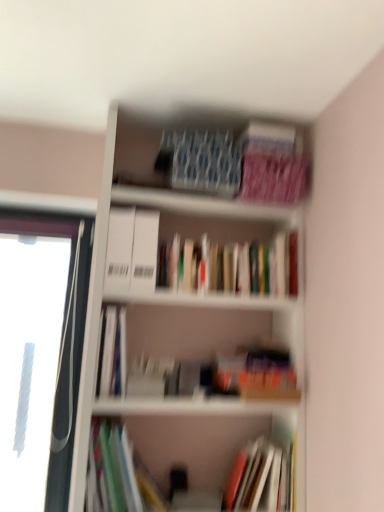
Question: Does multicolored paper at lower left, the 3th book when ordered from top to bottom, come in front of hardcover books at center, which is the 1th book in top-to-bottom order?

Choices:
 (A) no
 (B) yes

Answer: (B)

Question: Is multicolored paper at lower left, the 3th book when ordered from top to bottom, outside hardcover books at center, the fourth book ordered from the bottom?

Choices:
 (A) no
 (B) yes

Answer: (B)

Question: Does multicolored paper at lower left, which appears as the second book when ordered from the bottom, turn towards hardcover books at center, the fourth book ordered from the bottom?

Choices:
 (A) no
 (B) yes

Answer: (A)

Question: Is multicolored paper at lower left, the 3th book when ordered from top to bottom, thinner than hardcover books at center, which is the 1th book in top-to-bottom order?

Choices:
 (A) yes
 (B) no

Answer: (B)

Question: From a real-world perspective, is multicolored paper at lower left, which appears as the second book when ordered from the bottom, under hardcover books at center, which is the 1th book in top-to-bottom order?

Choices:
 (A) yes
 (B) no

Answer: (A)

Question: Can you confirm if multicolored paper at lower left, the 3th book when ordered from top to bottom, is shorter than hardcover books at center, the fourth book ordered from the bottom?

Choices:
 (A) yes
 (B) no

Answer: (B)

Question: Is hardcover books at center, which is the 1th book in top-to-bottom order, in front of multicolored paper at lower left, which appears as the second book when ordered from the bottom?

Choices:
 (A) no
 (B) yes

Answer: (A)

Question: From a real-world perspective, is hardcover books at center, the fourth book ordered from the bottom, positioned over multicolored paper at lower left, the 3th book when ordered from top to bottom, based on gravity?

Choices:
 (A) yes
 (B) no

Answer: (A)

Question: Is hardcover books at center, the fourth book ordered from the bottom, thinner than multicolored paper at lower left, which appears as the second book when ordered from the bottom?

Choices:
 (A) no
 (B) yes

Answer: (B)

Question: From the image's perspective, is hardcover books at center, which is the 1th book in top-to-bottom order, on multicolored paper at lower left, which appears as the second book when ordered from the bottom?

Choices:
 (A) yes
 (B) no

Answer: (A)

Question: Is hardcover books at center, which is the 1th book in top-to-bottom order, to the left of multicolored paper at lower left, which appears as the second book when ordered from the bottom, from the viewer's perspective?

Choices:
 (A) yes
 (B) no

Answer: (B)

Question: Is hardcover books at center, the fourth book ordered from the bottom, positioned beyond the bounds of multicolored paper at lower left, which appears as the second book when ordered from the bottom?

Choices:
 (A) no
 (B) yes

Answer: (B)

Question: Does white plastic window frame at left have a greater width compared to multicolored paper at lower left, the 3th book when ordered from top to bottom?

Choices:
 (A) no
 (B) yes

Answer: (A)